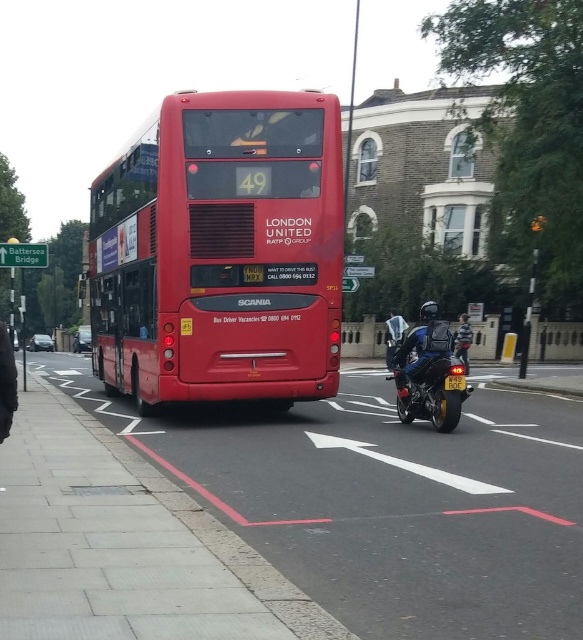
Based on the photo, is shiny blue motorcycle at right smaller than shiny blue motorcycle at center?

Indeed, shiny blue motorcycle at right has a smaller size compared to shiny blue motorcycle at center.

The image size is (583, 640). What do you see at coordinates (429, 376) in the screenshot? I see `shiny blue motorcycle at right` at bounding box center [429, 376].

Describe the element at coordinates (429, 376) in the screenshot. I see `shiny blue motorcycle at right` at that location.

Where is `shiny blue motorcycle at right`? The height and width of the screenshot is (640, 583). shiny blue motorcycle at right is located at coordinates (429, 376).

In the scene shown: Which is below, matte red bus at center or shiny blue motorcycle at right?

Positioned lower is shiny blue motorcycle at right.

The width and height of the screenshot is (583, 640). I want to click on matte red bus at center, so click(x=222, y=252).

Can you confirm if shiny blue motorcycle at center is positioned below yellow matte license plate at center?

Actually, shiny blue motorcycle at center is above yellow matte license plate at center.

Which of these two, shiny blue motorcycle at center or yellow matte license plate at center, stands taller?

Standing taller between the two is shiny blue motorcycle at center.

Between point (447, 337) and point (448, 387), which one is positioned in front?

Positioned in front is point (448, 387).

Locate an element on the screen. This screenshot has height=640, width=583. shiny blue motorcycle at center is located at coordinates (422, 348).